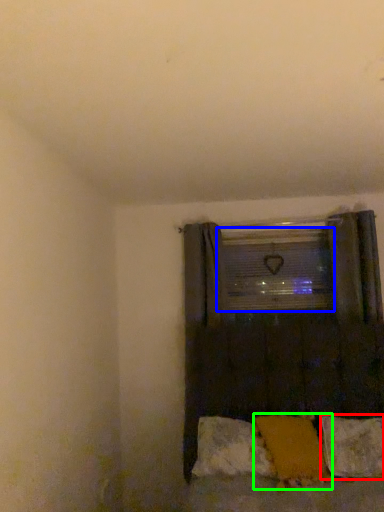
Question: Which object is positioned closest to pillow (highlighted by a red box)? Select from window screen (highlighted by a blue box) and pillow (highlighted by a green box).

Choices:
 (A) window screen
 (B) pillow

Answer: (B)